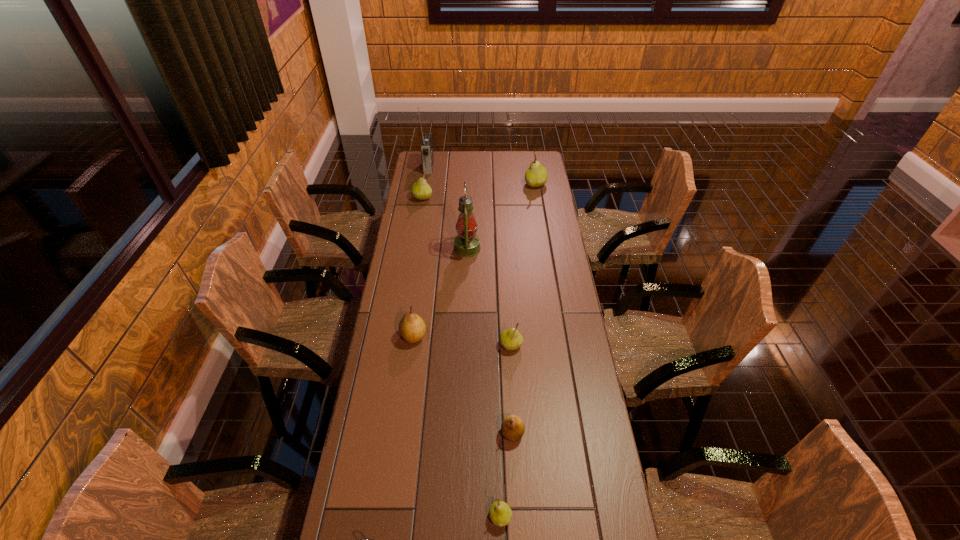
Locate which green pear ranks second in proximity to the second farthest pear. Please provide its 2D coordinates. Your answer should be formatted as a tuple, i.e. [(x, y)], where the tuple contains the x and y coordinates of a point satisfying the conditions above.

[(510, 339)]

Locate which green pear is the fourth closest to the left brown pear. Please provide its 2D coordinates. Your answer should be formatted as a tuple, i.e. [(x, y)], where the tuple contains the x and y coordinates of a point satisfying the conditions above.

[(536, 175)]

At what (x,y) coordinates should I click in order to perform the action: click on vacant space that satisfies the following two spatial constraints: 1. on the display of the radio receiver; 2. on the back side of the bigger brown pear. Please return your answer as a coordinate pair (x, y). Image resolution: width=960 pixels, height=540 pixels. Looking at the image, I should click on (402, 336).

Image resolution: width=960 pixels, height=540 pixels. I want to click on blank area in the image that satisfies the following two spatial constraints: 1. on the front side of the green oil lamp; 2. on the left side of the leftmost green pear, so click(414, 249).

Identify the location of vacant space that satisfies the following two spatial constraints: 1. on the display of the radio receiver; 2. on the left side of the green oil lamp. Image resolution: width=960 pixels, height=540 pixels. (416, 249).

The height and width of the screenshot is (540, 960). I want to click on vacant space that satisfies the following two spatial constraints: 1. on the back side of the seventh shortest object; 2. on the display of the farthest object, so click(x=533, y=167).